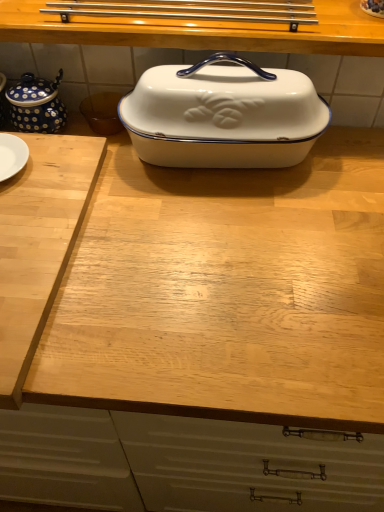
Identify the location of free space in front of white enamel casserole dish at center. (225, 246).